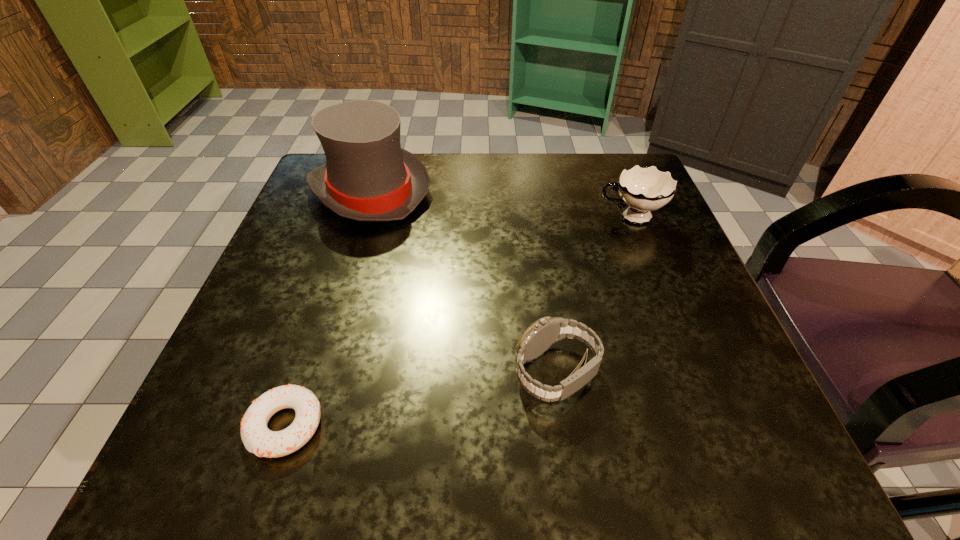
Identify the location of vacant region located 0.240m on the face of the second object from right to left. Image resolution: width=960 pixels, height=540 pixels. (346, 373).

You are a GUI agent. You are given a task and a screenshot of the screen. Output one action in this format:
    pyautogui.click(x=<x>, y=<y>)
    Task: Click on the free space located on the right of the shortest object
    Image resolution: width=960 pixels, height=540 pixels.
    Given the screenshot: What is the action you would take?
    pyautogui.click(x=432, y=426)

Find the location of a particular element. The image size is (960, 540). dress hat at the far edge is located at coordinates (368, 177).

The image size is (960, 540). Find the location of `cup that is at the far edge`. cup that is at the far edge is located at coordinates (644, 189).

Where is `watch present at the near edge`? This screenshot has width=960, height=540. watch present at the near edge is located at coordinates (545, 332).

The image size is (960, 540). What are the coordinates of `doughnut that is at the near edge` in the screenshot? It's located at (257, 438).

The image size is (960, 540). Find the location of `dress hat located at the left edge`. dress hat located at the left edge is located at coordinates (368, 177).

You are a GUI agent. You are given a task and a screenshot of the screen. Output one action in this format:
    pyautogui.click(x=<x>, y=<y>)
    Task: Click on the doughnut that is positioned at the left edge
    This screenshot has height=540, width=960.
    Given the screenshot: What is the action you would take?
    pyautogui.click(x=257, y=438)

Locate an element on the screen. object located at the right edge is located at coordinates (644, 189).

Locate an element on the screen. The image size is (960, 540). object at the far left corner is located at coordinates (368, 177).